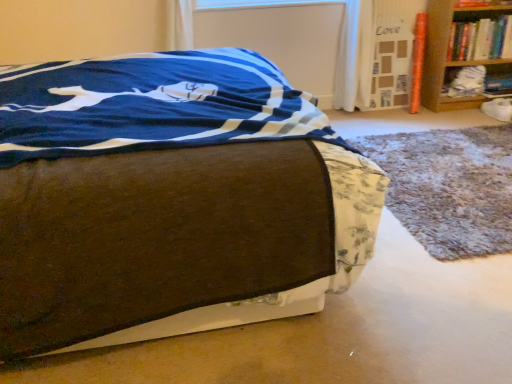
Question: Is hardcover book at upper right shorter than transparent plastic window screen at upper center?

Choices:
 (A) no
 (B) yes

Answer: (A)

Question: Is hardcover book at upper right oriented towards transparent plastic window screen at upper center?

Choices:
 (A) yes
 (B) no

Answer: (B)

Question: From a real-world perspective, does hardcover book at upper right sit lower than transparent plastic window screen at upper center?

Choices:
 (A) yes
 (B) no

Answer: (A)

Question: Is hardcover book at upper right to the right of transparent plastic window screen at upper center from the viewer's perspective?

Choices:
 (A) yes
 (B) no

Answer: (A)

Question: Can you confirm if hardcover book at upper right is smaller than transparent plastic window screen at upper center?

Choices:
 (A) no
 (B) yes

Answer: (A)

Question: From the image's perspective, is hardcover book at upper right located beneath transparent plastic window screen at upper center?

Choices:
 (A) no
 (B) yes

Answer: (B)

Question: Are hardcover book at upper right and white fabric at right, marked as the first shelf in a left-to-right arrangement, located far from each other?

Choices:
 (A) yes
 (B) no

Answer: (B)

Question: Can you confirm if hardcover book at upper right is thinner than white fabric at right, marked as the first shelf in a left-to-right arrangement?

Choices:
 (A) no
 (B) yes

Answer: (B)

Question: Considering the relative sizes of hardcover book at upper right and white fabric at right, marked as the first shelf in a left-to-right arrangement, in the image provided, is hardcover book at upper right taller than white fabric at right, marked as the first shelf in a left-to-right arrangement,?

Choices:
 (A) yes
 (B) no

Answer: (A)

Question: Considering the relative positions of hardcover book at upper right and white fabric at right, which is counted as the second shelf, starting from the right, in the image provided, is hardcover book at upper right in front of white fabric at right, which is counted as the second shelf, starting from the right,?

Choices:
 (A) yes
 (B) no

Answer: (A)

Question: From the image's perspective, is hardcover book at upper right under white fabric at right, which is counted as the second shelf, starting from the right?

Choices:
 (A) yes
 (B) no

Answer: (B)

Question: From a real-world perspective, is hardcover book at upper right located beneath white fabric at right, marked as the first shelf in a left-to-right arrangement?

Choices:
 (A) yes
 (B) no

Answer: (B)

Question: Considering the relative sizes of brown fabric bed at center and hardcover book at upper right in the image provided, is brown fabric bed at center thinner than hardcover book at upper right?

Choices:
 (A) yes
 (B) no

Answer: (B)